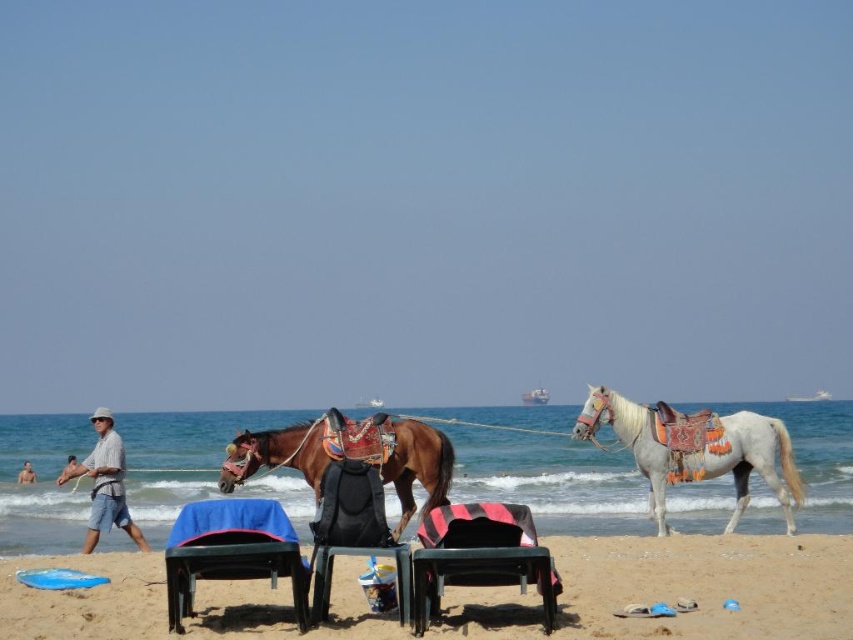
You are a photographer setting up equipment on the beach. You need to position a tall tripod so it doesn not block the view of the white glossy horse at right. Given the black plastic beach chair at center is already in place, will the tripod, which is as tall as the horse, interfere with the view of the horse?

The white glossy horse at right is taller than the black plastic beach chair at center. Since the tripod is as tall as the horse, it might block the view of the horse if placed between the observer and the horse.

You are a photographer trying to capture a photo of the white glossy horse at right and the black plastic beach chair at center from a distance. If your camera has a maximum focus range of 15 meters, will you be able to clearly capture both subjects in focus?

The white glossy horse at right is 18.21 meters away from the black plastic beach chair at center. Since the camera can only focus up to 15 meters, it won cannot capture both subjects in focus as the distance between them exceeds the camera range.

You are a photographer at the beach scene described. You need to position yourself so that the white glossy horse at right and the light blue denim shorts at lower left are both visible in your shot. Based on their positions, which object is higher up in the frame?

The white glossy horse at right is above the light blue denim shorts at lower left, so it will appear higher up in the frame.